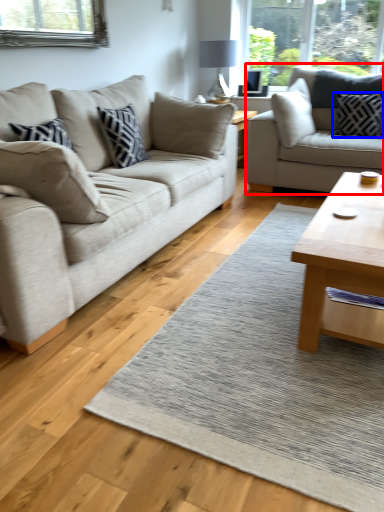
Question: Which object appears farthest to the camera in this image, studio couch (highlighted by a red box) or pillow (highlighted by a blue box)?

Choices:
 (A) studio couch
 (B) pillow

Answer: (B)